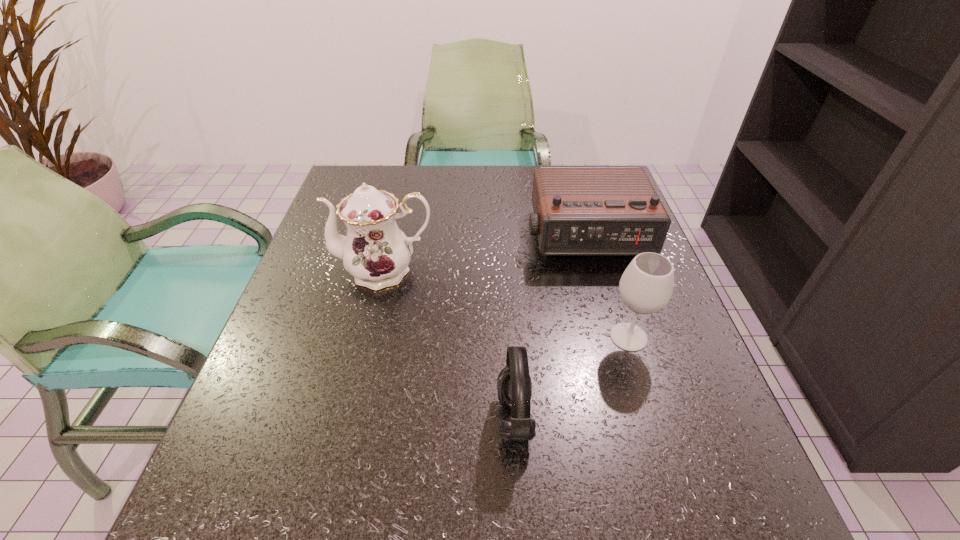
Identify the location of the tallest object. (375, 252).

Locate an element on the screen. This screenshot has width=960, height=540. the leftmost object is located at coordinates (375, 252).

Find the location of a particular element. The image size is (960, 540). the second nearest object is located at coordinates (x=646, y=286).

Find the location of a particular element. wineglass is located at coordinates (646, 286).

I want to click on radio receiver, so click(578, 211).

Where is `the nearest object`? Image resolution: width=960 pixels, height=540 pixels. the nearest object is located at coordinates (x=514, y=386).

Identify the location of headset. (514, 386).

Locate an element on the screen. The height and width of the screenshot is (540, 960). vacant space located on the back of the chinaware is located at coordinates (405, 185).

Find the location of `vacant space located 0.130m on the front of the third farthest object`. vacant space located 0.130m on the front of the third farthest object is located at coordinates (655, 420).

The image size is (960, 540). I want to click on free spot located on the tuning display of the radio receiver, so point(638,424).